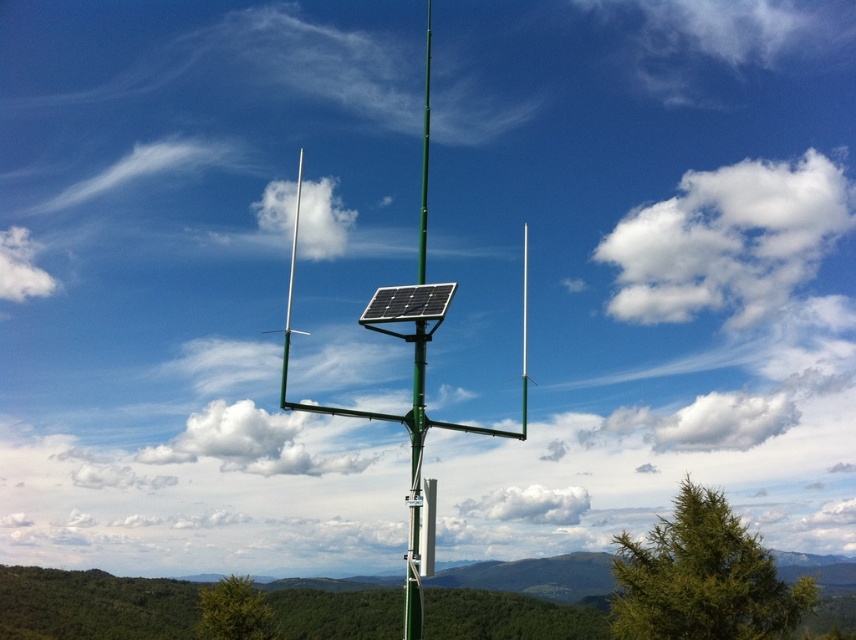
Question: Can you confirm if green metallic antenna at center is positioned to the right of green metallic pole at center?

Choices:
 (A) no
 (B) yes

Answer: (B)

Question: Estimate the real-world distances between objects in this image. Which object is farther from the green metallic antenna at center?

Choices:
 (A) green metallic pole at center
 (B) black rigid solar panel at center

Answer: (B)

Question: Is green metallic antenna at center thinner than black rigid solar panel at center?

Choices:
 (A) no
 (B) yes

Answer: (A)

Question: Can you confirm if green metallic antenna at center is smaller than black rigid solar panel at center?

Choices:
 (A) no
 (B) yes

Answer: (A)

Question: Estimate the real-world distances between objects in this image. Which object is closer to the green metallic antenna at center?

Choices:
 (A) black rigid solar panel at center
 (B) green metallic pole at center

Answer: (B)

Question: Which object appears farthest from the camera in this image?

Choices:
 (A) green metallic antenna at center
 (B) green metallic pole at center

Answer: (B)